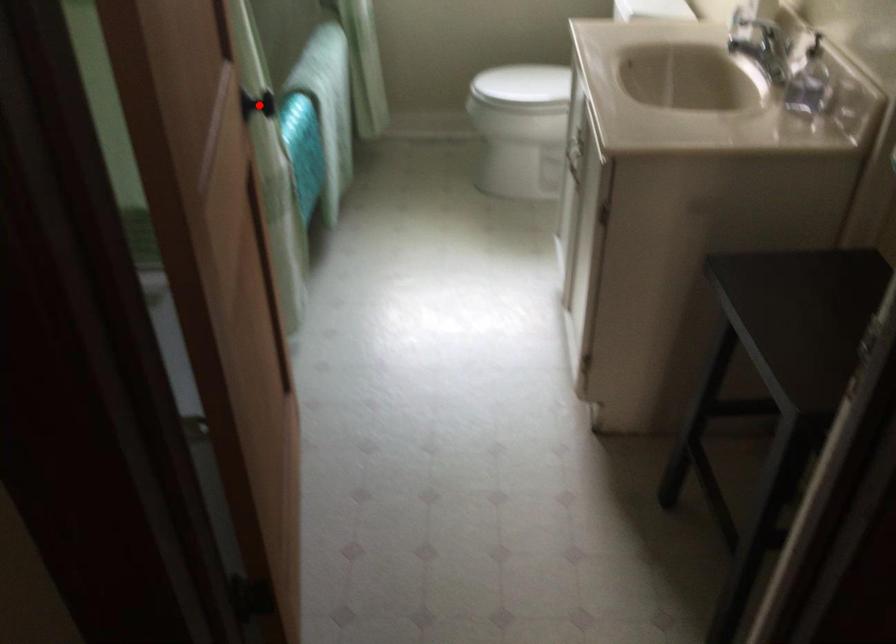
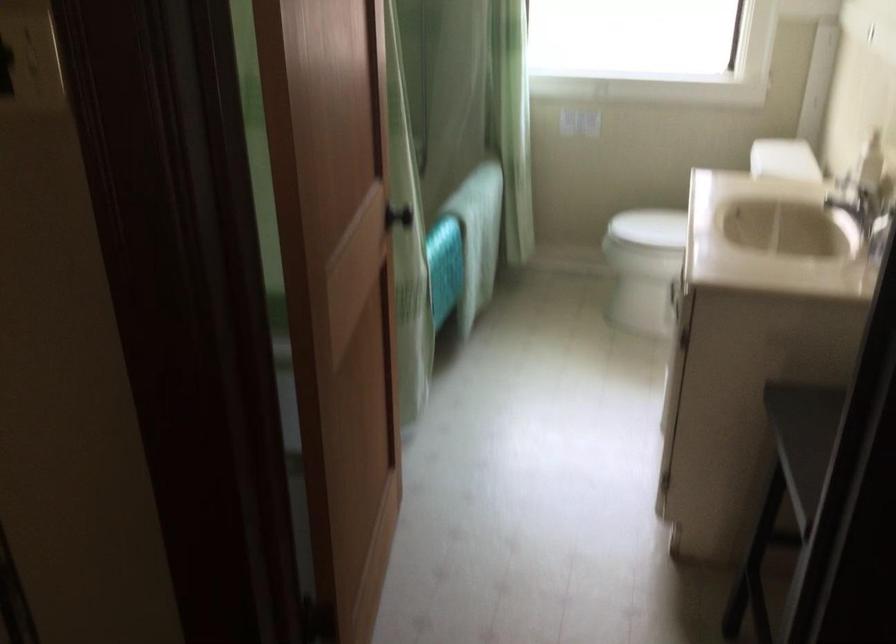
Question: I am providing you with two images of the same scene from different viewpoints. A red point is shown in image1. For the corresponding object point in image2, is it positioned nearer or farther from the camera?

Choices:
 (A) Nearer
 (B) Farther

Answer: (B)